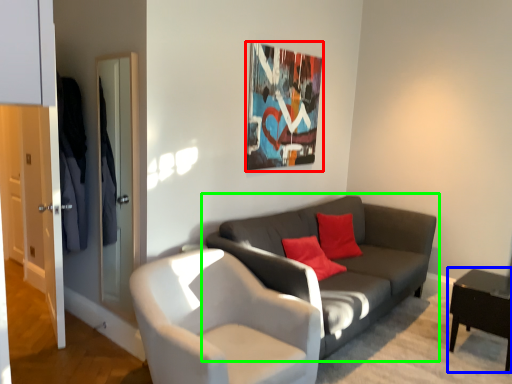
Question: Considering the real-world distances, which object is closest to picture frame (highlighted by a red box)? table (highlighted by a blue box) or studio couch (highlighted by a green box).

Choices:
 (A) table
 (B) studio couch

Answer: (B)